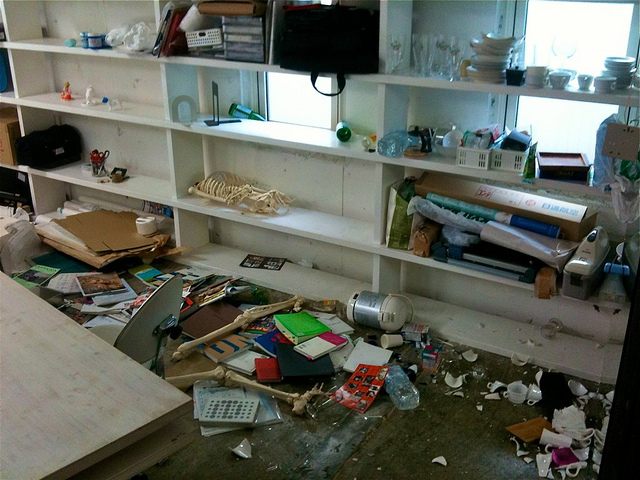
At what (x,y) coordinates should I click in order to perform the action: click on carpet. Please return your answer as a coordinate pair (x, y). This screenshot has width=640, height=480. Looking at the image, I should click on (473, 427).